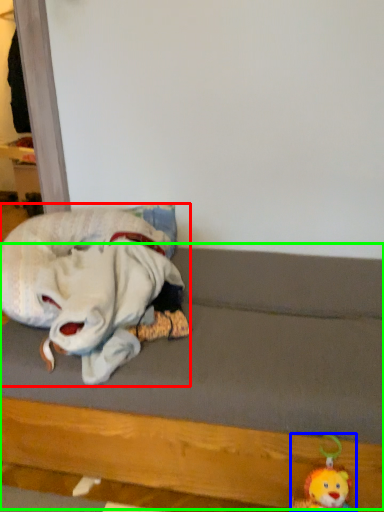
Question: Considering the real-world distances, which object is closest to toy (highlighted by a red box)? toy (highlighted by a blue box) or bed frame (highlighted by a green box).

Choices:
 (A) toy
 (B) bed frame

Answer: (B)